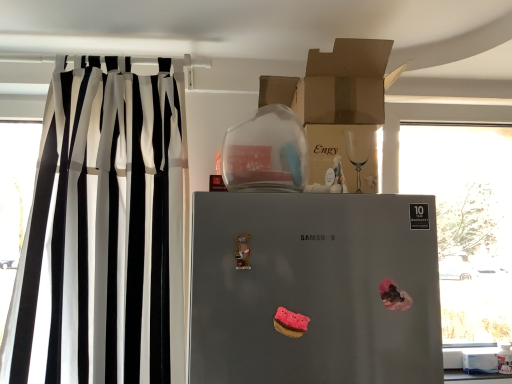
Identify the location of vacant space situated above black/white striped curtain at left (from a real-world perspective). (110, 46).